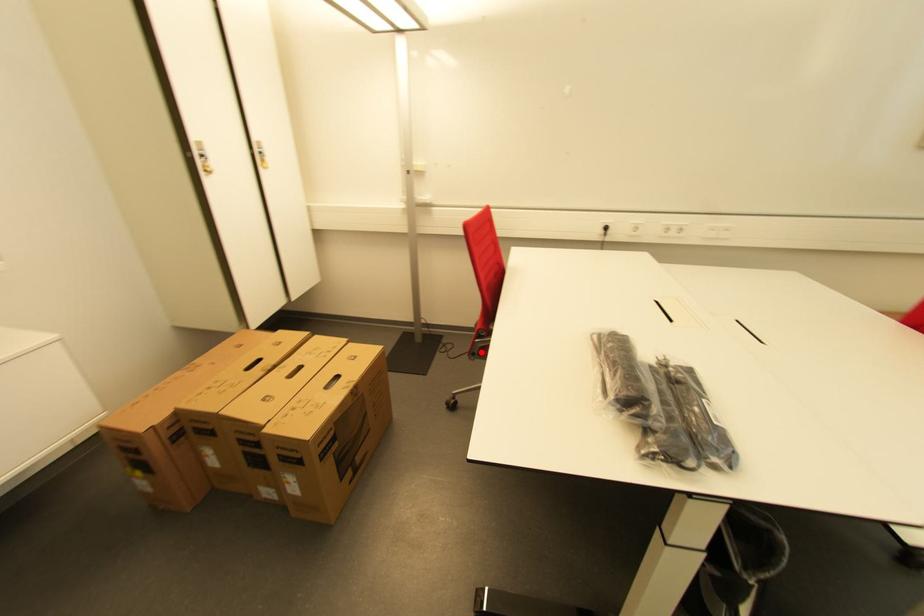
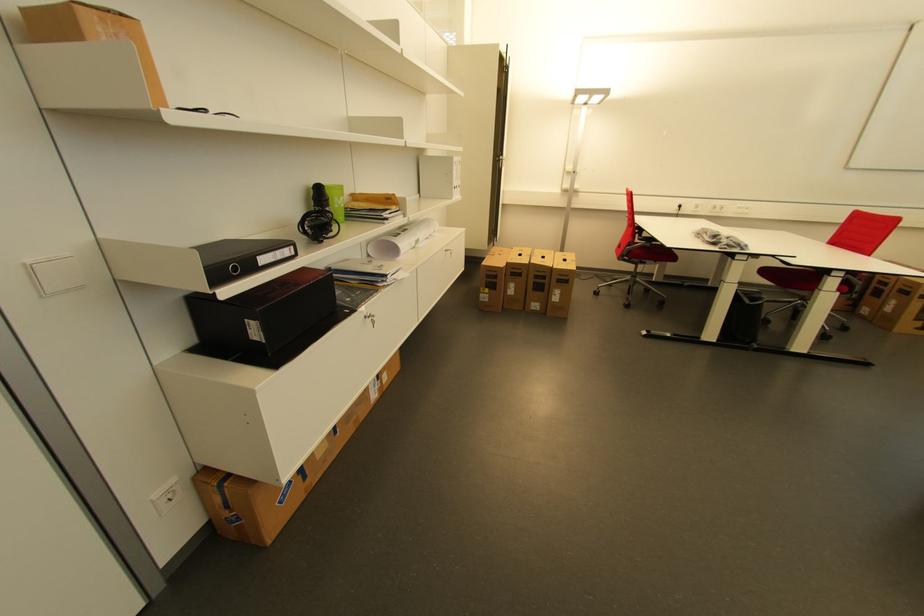
Question: I am providing you with two images of the same scene from different viewpoints. In image1, a red point is highlighted. Considering the same 3D point in image2, which of the following is correct?

Choices:
 (A) It is closer
 (B) It is farther

Answer: (A)